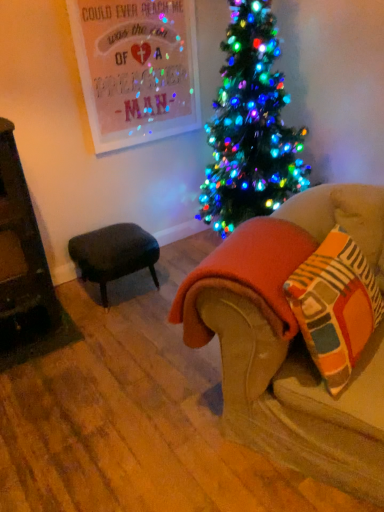
This screenshot has height=512, width=384. Describe the element at coordinates (114, 254) in the screenshot. I see `dark gray fabric stool at lower left` at that location.

Find the location of a particular element. Image resolution: width=384 pixels, height=512 pixels. dark gray fabric stool at lower left is located at coordinates (114, 254).

Considering the relative positions of velvet beige couch at lower right and dark gray fabric stool at lower left in the image provided, is velvet beige couch at lower right to the right of dark gray fabric stool at lower left from the viewer's perspective?

Indeed, velvet beige couch at lower right is positioned on the right side of dark gray fabric stool at lower left.

Considering the sizes of objects velvet beige couch at lower right and dark gray fabric stool at lower left in the image provided, who is taller, velvet beige couch at lower right or dark gray fabric stool at lower left?

dark gray fabric stool at lower left.

Does velvet beige couch at lower right have a greater width compared to dark gray fabric stool at lower left?

Indeed, velvet beige couch at lower right has a greater width compared to dark gray fabric stool at lower left.

How far apart are velvet beige couch at lower right and dark gray fabric stool at lower left?

A distance of 1.10 meters exists between velvet beige couch at lower right and dark gray fabric stool at lower left.

Does point (337, 262) come farther from viewer compared to point (341, 443)?

That is True.

Looking at this image, from the image's perspective, is striped cotton throw pillow at lower right on velvet beige couch at lower right?

Yes, from the image's perspective, striped cotton throw pillow at lower right is on top of velvet beige couch at lower right.

This screenshot has height=512, width=384. I want to click on throw pillow above the velvet beige couch at lower right (from the image's perspective), so click(335, 306).

Is striped cotton throw pillow at lower right taller or shorter than orange fleece blanket at lower right?

Considering their sizes, striped cotton throw pillow at lower right has more height than orange fleece blanket at lower right.

Is point (332, 269) farther from camera compared to point (197, 327)?

No, (332, 269) is in front of (197, 327).

Can we say striped cotton throw pillow at lower right lies outside orange fleece blanket at lower right?

Yes, striped cotton throw pillow at lower right is located beyond the bounds of orange fleece blanket at lower right.

In the scene shown: Is striped cotton throw pillow at lower right with orange fleece blanket at lower right?

No, striped cotton throw pillow at lower right is not touching orange fleece blanket at lower right.

Considering the positions of points (377, 300) and (121, 237), is point (377, 300) closer to camera compared to point (121, 237)?

Yes, point (377, 300) is closer to viewer.

In the scene shown: Would you say striped cotton throw pillow at lower right contains dark gray fabric stool at lower left?

No, dark gray fabric stool at lower left is not surrounded by striped cotton throw pillow at lower right.

Is striped cotton throw pillow at lower right shorter than dark gray fabric stool at lower left?

In fact, striped cotton throw pillow at lower right may be taller than dark gray fabric stool at lower left.

Could you tell me if striped cotton throw pillow at lower right is facing dark gray fabric stool at lower left?

No, striped cotton throw pillow at lower right does not turn towards dark gray fabric stool at lower left.

Considering the relative positions of dark gray fabric stool at lower left and orange fleece blanket at lower right in the image provided, is dark gray fabric stool at lower left to the left of orange fleece blanket at lower right from the viewer's perspective?

Yes.

Is dark gray fabric stool at lower left directly adjacent to orange fleece blanket at lower right?

dark gray fabric stool at lower left and orange fleece blanket at lower right are not in contact.

In order to click on blanket positioned vertically above the dark gray fabric stool at lower left (from a real-world perspective) in this screenshot , I will do (x=247, y=276).

Is dark gray fabric stool at lower left shorter than orange fleece blanket at lower right?

Yes, dark gray fabric stool at lower left is shorter than orange fleece blanket at lower right.

Is dark gray fabric stool at lower left located outside striped cotton throw pillow at lower right?

Absolutely, dark gray fabric stool at lower left is external to striped cotton throw pillow at lower right.

Is dark gray fabric stool at lower left behind striped cotton throw pillow at lower right?

Yes, dark gray fabric stool at lower left is further from the viewer.

Is point (154, 253) in front of point (342, 318)?

No, (154, 253) is behind (342, 318).

From the picture: Can you confirm if dark gray fabric stool at lower left is taller than striped cotton throw pillow at lower right?

In fact, dark gray fabric stool at lower left may be shorter than striped cotton throw pillow at lower right.

Can you confirm if velvet beige couch at lower right is wider than striped cotton throw pillow at lower right?

Indeed, velvet beige couch at lower right has a greater width compared to striped cotton throw pillow at lower right.

Is velvet beige couch at lower right not within striped cotton throw pillow at lower right?

Yes.

Could you measure the distance between velvet beige couch at lower right and striped cotton throw pillow at lower right?

6.38 inches.

From a real-world perspective, is velvet beige couch at lower right on top of striped cotton throw pillow at lower right?

No, from a real-world perspective, velvet beige couch at lower right is not on top of striped cotton throw pillow at lower right.

Where is `table above the velvet beige couch at lower right (from the image's perspective)`? The width and height of the screenshot is (384, 512). table above the velvet beige couch at lower right (from the image's perspective) is located at coordinates (114, 254).

Image resolution: width=384 pixels, height=512 pixels. Find the location of `studio couch on the left of striped cotton throw pillow at lower right`. studio couch on the left of striped cotton throw pillow at lower right is located at coordinates (290, 342).

Estimate the real-world distances between objects in this image. Which object is closer to striped cotton throw pillow at lower right, dark gray fabric stool at lower left or orange fleece blanket at lower right?

The object closer to striped cotton throw pillow at lower right is orange fleece blanket at lower right.

Estimate the real-world distances between objects in this image. Which object is closer to orange fleece blanket at lower right, striped cotton throw pillow at lower right or dark gray fabric stool at lower left?

striped cotton throw pillow at lower right lies closer to orange fleece blanket at lower right than the other object.

When comparing their distances from dark gray fabric stool at lower left, does velvet beige couch at lower right or orange fleece blanket at lower right seem further?

velvet beige couch at lower right.

Considering their positions, is dark gray fabric stool at lower left positioned closer to velvet beige couch at lower right than striped cotton throw pillow at lower right?

The object closer to velvet beige couch at lower right is striped cotton throw pillow at lower right.

Looking at the image, which one is located closer to velvet beige couch at lower right, orange fleece blanket at lower right or dark gray fabric stool at lower left?

Among the two, orange fleece blanket at lower right is located nearer to velvet beige couch at lower right.

Considering their positions, is velvet beige couch at lower right positioned closer to striped cotton throw pillow at lower right than orange fleece blanket at lower right?

velvet beige couch at lower right lies closer to striped cotton throw pillow at lower right than the other object.

Which object lies further to the anchor point dark gray fabric stool at lower left, orange fleece blanket at lower right or striped cotton throw pillow at lower right?

The object further to dark gray fabric stool at lower left is striped cotton throw pillow at lower right.

Which object lies nearer to the anchor point orange fleece blanket at lower right, dark gray fabric stool at lower left or velvet beige couch at lower right?

velvet beige couch at lower right lies closer to orange fleece blanket at lower right than the other object.

The height and width of the screenshot is (512, 384). I want to click on throw pillow between velvet beige couch at lower right and dark gray fabric stool at lower left in the front-back direction, so click(335, 306).

Identify the location of blanket between velvet beige couch at lower right and dark gray fabric stool at lower left along the z-axis. This screenshot has height=512, width=384. (247, 276).

Identify the location of blanket positioned between striped cotton throw pillow at lower right and dark gray fabric stool at lower left from near to far. The width and height of the screenshot is (384, 512). (247, 276).

The width and height of the screenshot is (384, 512). I want to click on blanket between velvet beige couch at lower right and striped cotton throw pillow at lower right, so click(x=247, y=276).